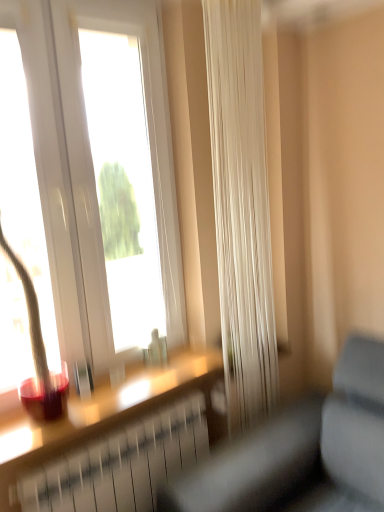
This screenshot has width=384, height=512. What are the coordinates of `free point above matte glass window sill at lower left (from a real-world perspective)` in the screenshot? It's located at (118, 390).